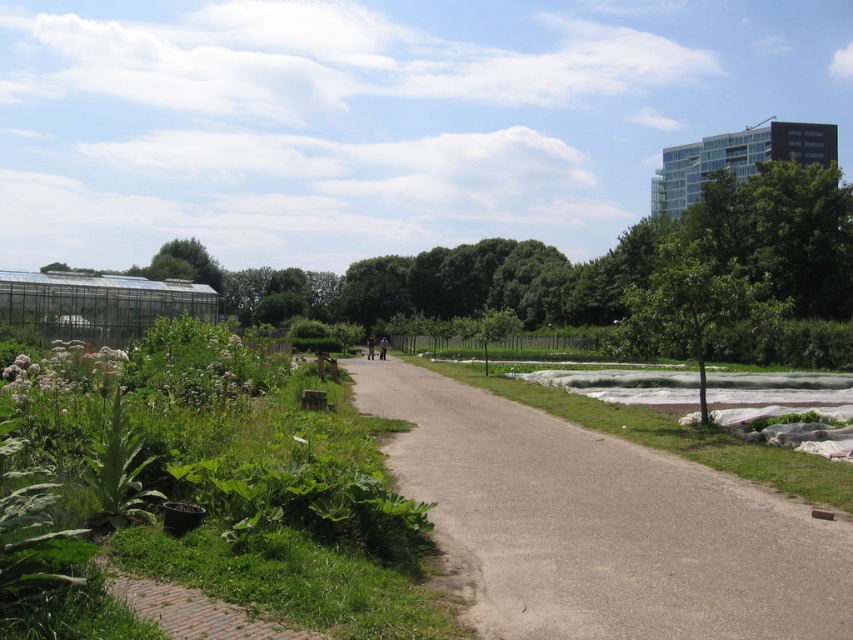
Question: Which of the following is the farthest from the observer?

Choices:
 (A) (181, 573)
 (B) (834, 538)

Answer: (B)

Question: Which point is farther to the camera?

Choices:
 (A) (671, 248)
 (B) (579, 620)

Answer: (A)

Question: Can you confirm if green leafy plants at left is wider than green leafy tree at center-right?

Choices:
 (A) yes
 (B) no

Answer: (B)

Question: Which object is positioned closest to the green leafy tree at center-right?

Choices:
 (A) gray asphalt path at center
 (B) green leafy plants at left

Answer: (B)

Question: From the image, what is the correct spatial relationship of green leafy plants at left in relation to green leafy tree at center-right?

Choices:
 (A) below
 (B) above

Answer: (A)

Question: Is green leafy plants at left bigger than green leafy tree at center-right?

Choices:
 (A) yes
 (B) no

Answer: (B)